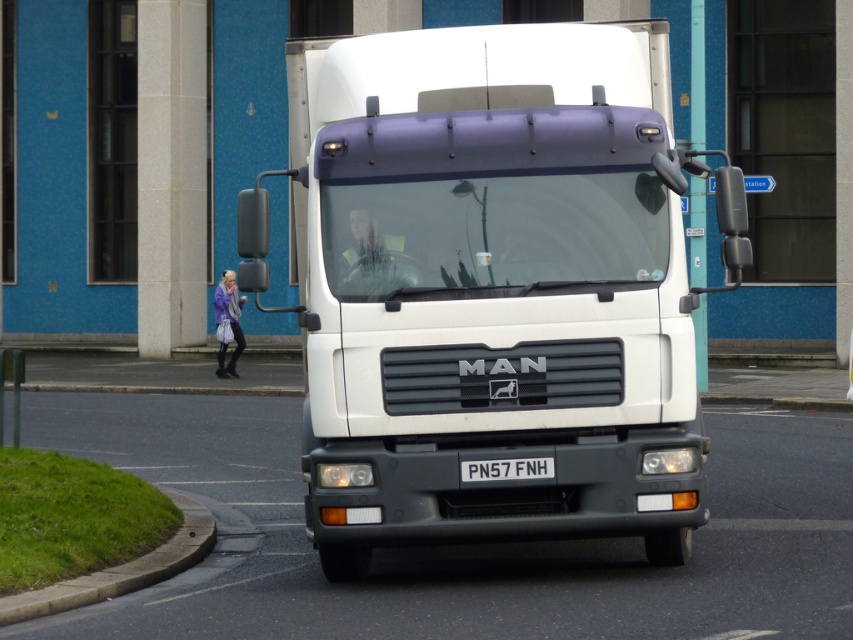
How distant is white glossy trailer truck at center from green concrete curb at lower left?

white glossy trailer truck at center and green concrete curb at lower left are 2.33 meters apart.

Identify the location of white glossy trailer truck at center. (494, 289).

Identify the location of white glossy trailer truck at center. The image size is (853, 640). (494, 289).

Between white glossy trailer truck at center and black metal license plate at center, which one is positioned lower?

Positioned lower is white glossy trailer truck at center.

Image resolution: width=853 pixels, height=640 pixels. What do you see at coordinates (494, 289) in the screenshot?
I see `white glossy trailer truck at center` at bounding box center [494, 289].

What are the coordinates of `white glossy trailer truck at center` in the screenshot? It's located at (494, 289).

Does green concrete curb at lower left have a smaller size compared to black metal license plate at center?

Incorrect, green concrete curb at lower left is not smaller in size than black metal license plate at center.

The width and height of the screenshot is (853, 640). Find the location of `green concrete curb at lower left`. green concrete curb at lower left is located at coordinates (120, 570).